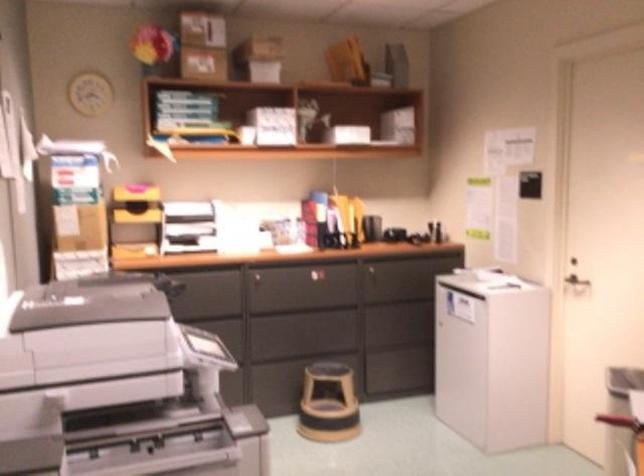
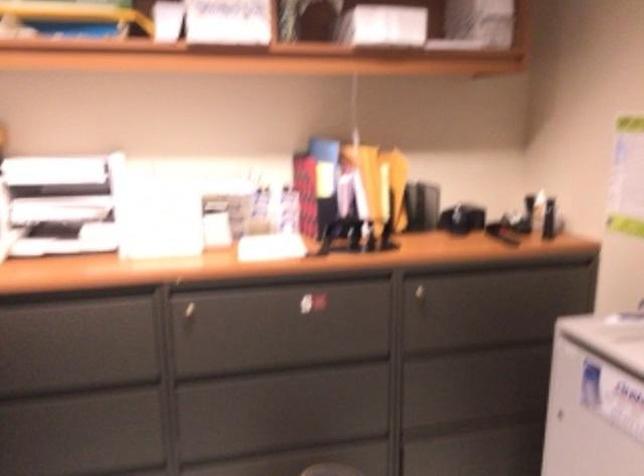
Find the pixel in the second image that matches (412,280) in the first image.

(489, 311)